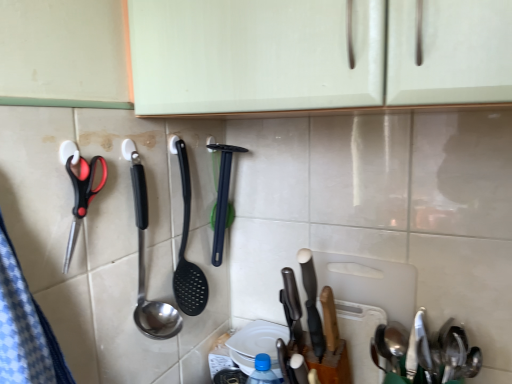
Question: Based on their sizes in the image, would you say white matte cutting board at center-right is bigger or smaller than polished stainless steel spoon at center, positioned as the 2th spoon in right-to-left order?

Choices:
 (A) big
 (B) small

Answer: (B)

Question: From a real-world perspective, is white matte cutting board at center-right positioned above or below polished stainless steel spoon at center, which is the first spoon in top-to-bottom order?

Choices:
 (A) above
 (B) below

Answer: (B)

Question: Based on their relative distances, which object is farther from the polished stainless steel knife at center?

Choices:
 (A) satin silver spoon at lower right, which appears as the first spoon when ordered from the bottom
 (B) black plastic spatula at center
 (C) polished stainless steel spoon at center, which is counted as the first spoon, starting from the left
 (D) white matte cutting board at center-right
 (E) white glossy plate at center

Answer: (C)

Question: Which is nearer to the satin silver spoon at lower right, which appears as the first spoon when ordered from the bottom?

Choices:
 (A) white glossy plate at center
 (B) white matte cutting board at center-right
 (C) black plastic spatula at center
 (D) polished stainless steel knife at center
 (E) polished stainless steel spoon at center, positioned as the 2th spoon in right-to-left order

Answer: (B)